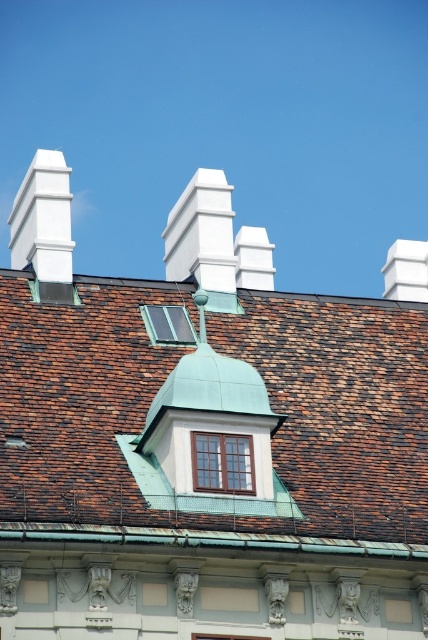
Does brown shingles at center have a lesser width compared to clear glass window at center?

No.

Can you confirm if brown shingles at center is wider than clear glass window at center?

Yes.

At what (x,y) coordinates should I click in order to perform the action: click on brown shingles at center. Please return your answer as a coordinate pair (x, y). This screenshot has height=640, width=428. Looking at the image, I should click on pos(214,408).

Which is behind, point (216, 465) or point (183, 330)?

The point (183, 330) is behind.

Locate an element on the screen. clear glass window at center is located at coordinates (222, 461).

Is brown shingles at center taller than transparent glass window at center?

Yes.

Is brown shingles at center wider than transparent glass window at center?

Yes, brown shingles at center is wider than transparent glass window at center.

Which is behind, point (341, 481) or point (178, 333)?

Positioned behind is point (178, 333).

The width and height of the screenshot is (428, 640). In order to click on brown shingles at center in this screenshot , I will do `click(214, 408)`.